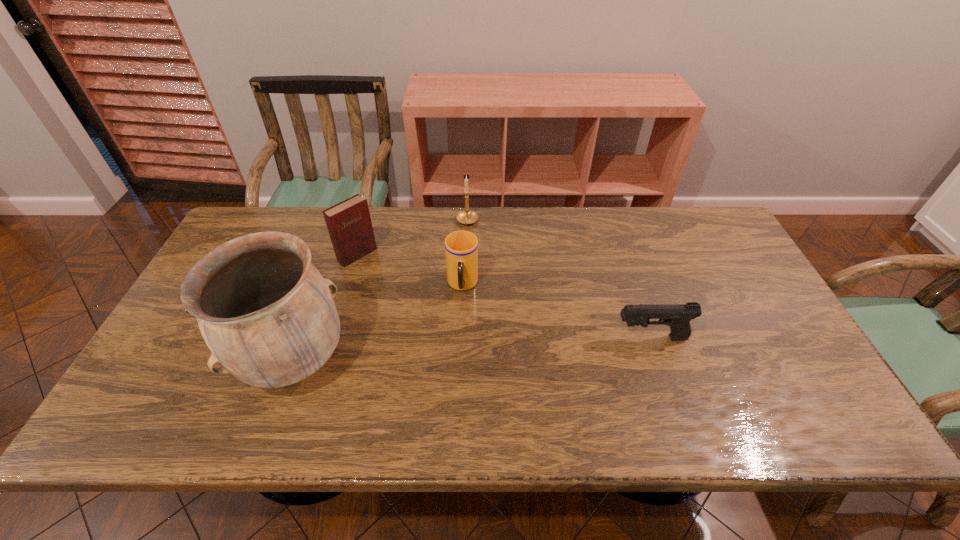
Locate an element on the screen. object located at the near edge is located at coordinates (267, 315).

Locate an element on the screen. vacant space at the far edge is located at coordinates (588, 249).

Identify the location of free space at the near edge of the desktop. The width and height of the screenshot is (960, 540). click(x=620, y=385).

I want to click on free space at the right edge of the desktop, so click(696, 259).

Image resolution: width=960 pixels, height=540 pixels. Identify the location of vacant space at the near left corner of the desktop. (158, 392).

I want to click on vacant area at the far right corner of the desktop, so click(710, 214).

The height and width of the screenshot is (540, 960). Find the location of `vacant space at the near right corner of the desktop`. vacant space at the near right corner of the desktop is located at coordinates (803, 373).

At what (x,y) coordinates should I click in order to perform the action: click on free spot between the urn and the candle holder. Please return your answer as a coordinate pair (x, y). The image size is (960, 540). Looking at the image, I should click on [x=381, y=292].

At what (x,y) coordinates should I click in order to perform the action: click on vacant space that's between the diary and the farthest object. Please return your answer as a coordinate pair (x, y). The width and height of the screenshot is (960, 540). Looking at the image, I should click on tap(413, 239).

At what (x,y) coordinates should I click in order to perform the action: click on vacant space that's between the rightmost object and the tallest object. Please return your answer as a coordinate pair (x, y). The height and width of the screenshot is (540, 960). Looking at the image, I should click on (472, 349).